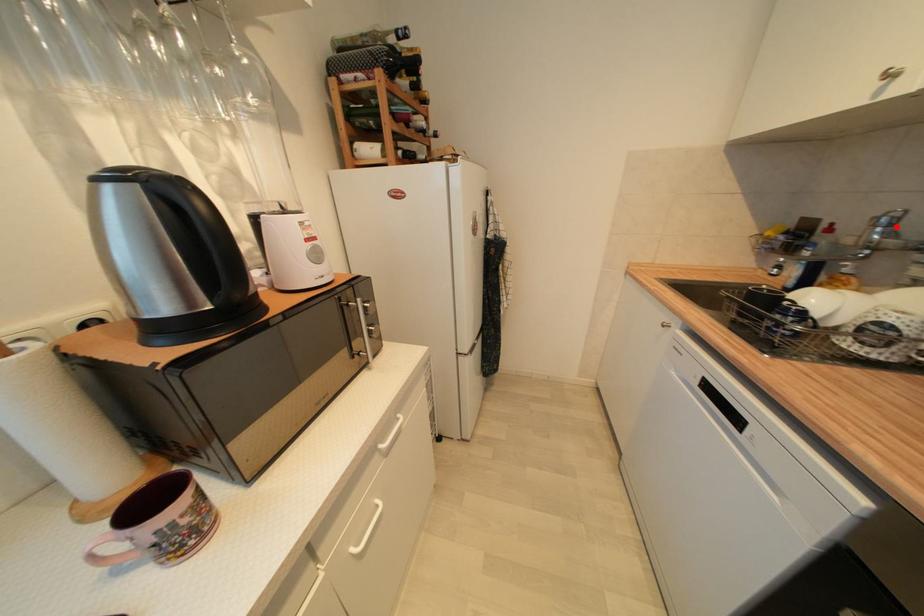
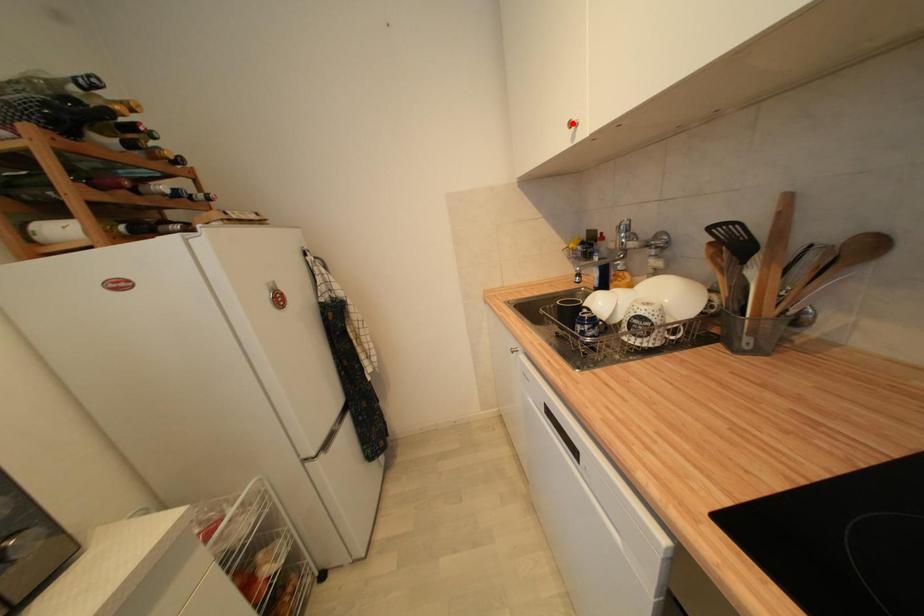
I am providing you with two images of the same scene from different viewpoints. A red point is marked on the first image and another point is marked on the second image. Does the point marked in image1 correspond to the same location as the one in image2?

No